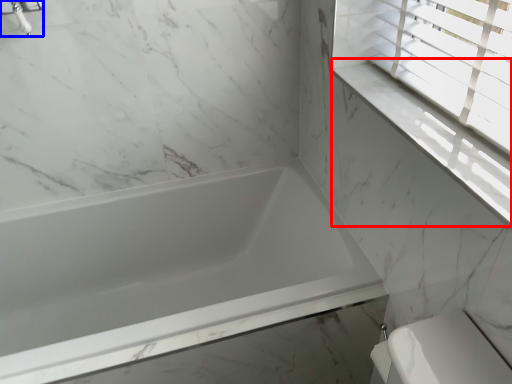
Question: Among these objects, which one is nearest to the camera, window sill (highlighted by a red box) or faucet (highlighted by a blue box)?

Choices:
 (A) window sill
 (B) faucet

Answer: (A)